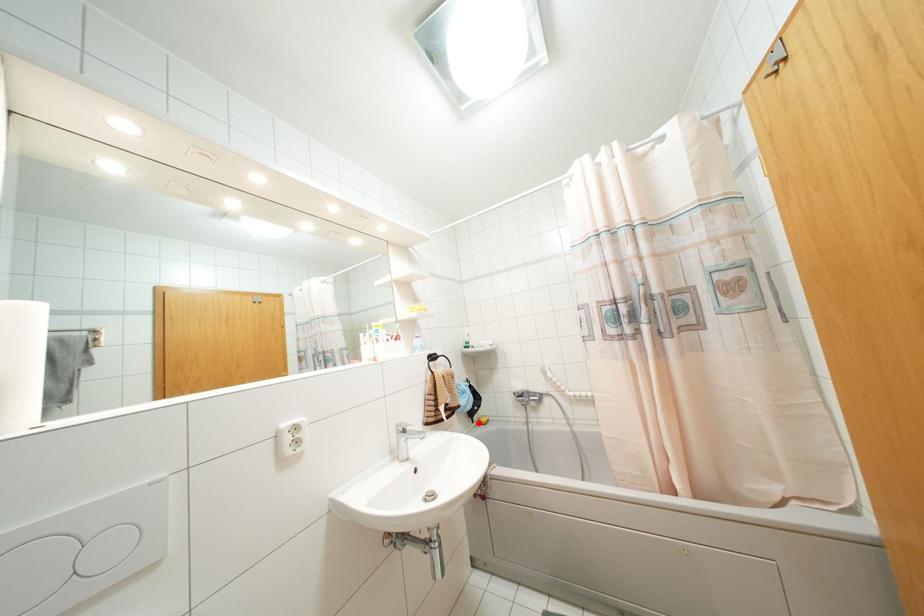
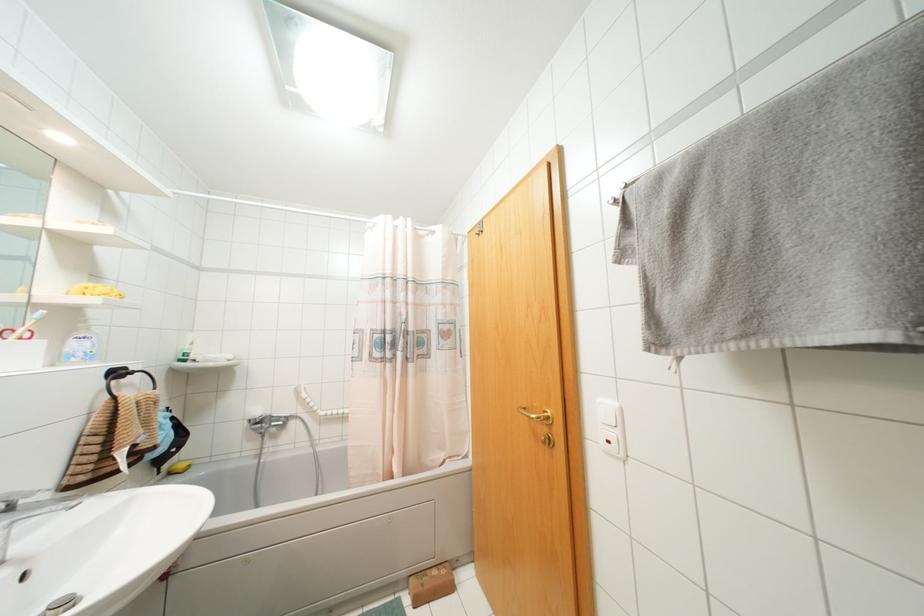
In the second image, find the point that corresponds to the highlighted location in the first image.

(169, 472)